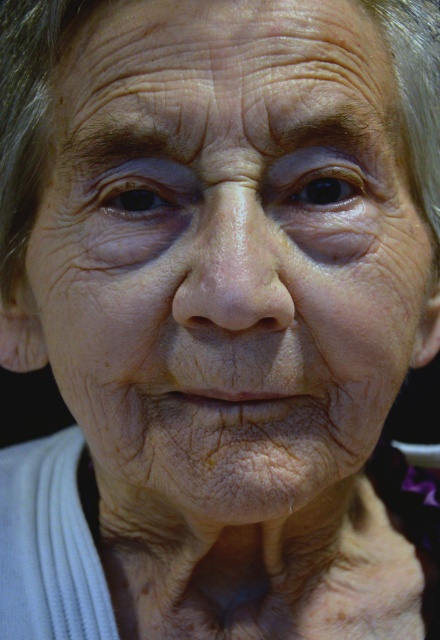
Who is taller, brown matte eye at upper center or brown matte eye at upper left?

brown matte eye at upper center is taller.

Locate an element on the screen. brown matte eye at upper center is located at coordinates (326, 188).

Where is `brown matte eye at upper center`? The height and width of the screenshot is (640, 440). brown matte eye at upper center is located at coordinates (326, 188).